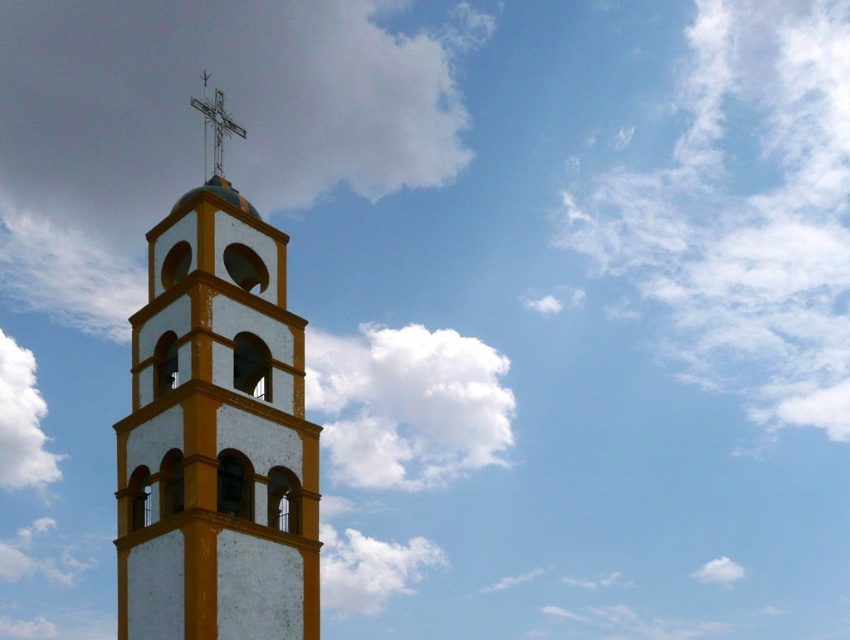
Question: Which object is positioned farthest from the white fluffy cloud at center?

Choices:
 (A) white fluffy cloud at upper center
 (B) metallic cross at upper center
 (C) white painted stone bell tower at left

Answer: (B)

Question: Does white painted stone bell tower at left lie behind white fluffy cloud at upper center?

Choices:
 (A) yes
 (B) no

Answer: (B)

Question: Which of the following is the closest to the observer?

Choices:
 (A) (46, 467)
 (B) (221, 152)
 (C) (122, 472)

Answer: (C)

Question: Among these points, which one is farthest from the camera?

Choices:
 (A) [0, 332]
 (B) [214, 152]
 (C) [412, 333]

Answer: (A)

Question: Can you confirm if white fluffy cloud at upper left is bigger than metallic cross at upper center?

Choices:
 (A) no
 (B) yes

Answer: (A)

Question: From the image, what is the correct spatial relationship of white painted stone bell tower at left in relation to white fluffy cloud at upper center?

Choices:
 (A) below
 (B) above

Answer: (B)